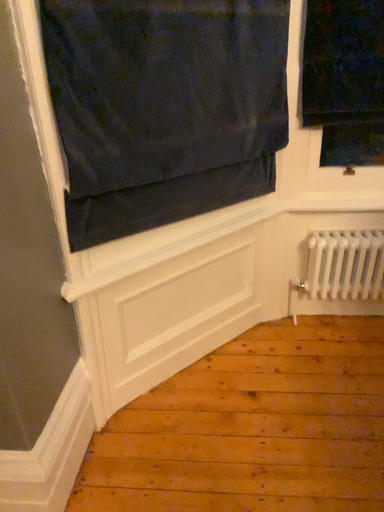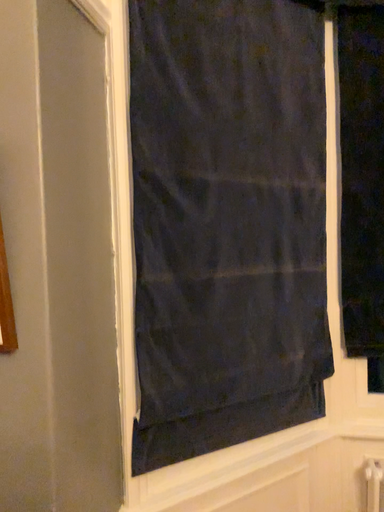
Question: Which way did the camera rotate in the video?

Choices:
 (A) rotated right
 (B) rotated left

Answer: (B)